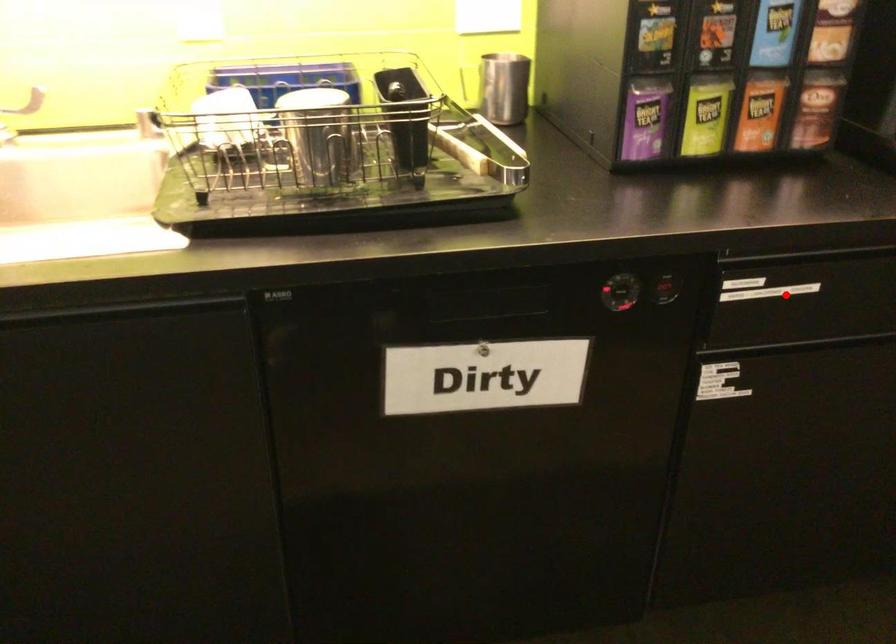
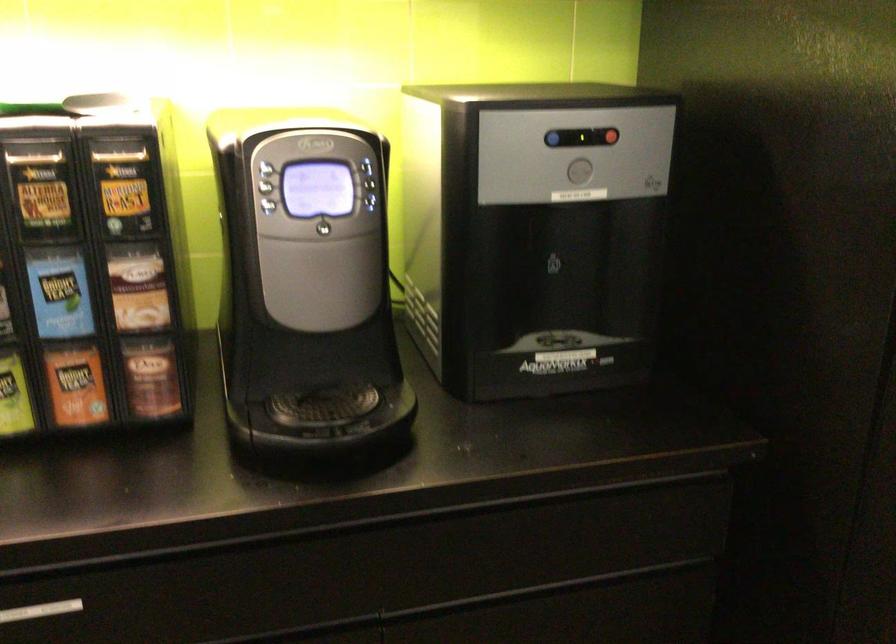
Question: I am providing you with two images of the same scene from different viewpoints. A red point is shown in image1. For the corresponding object point in image2, is it positioned nearer or farther from the camera?

Choices:
 (A) Nearer
 (B) Farther

Answer: (A)